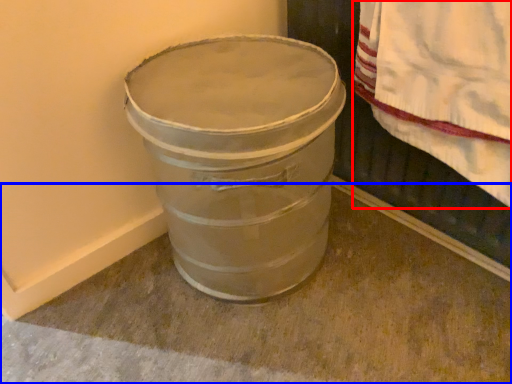
Question: Which of the following is the closest to the observer, blanket (highlighted by a red box) or concrete (highlighted by a blue box)?

Choices:
 (A) blanket
 (B) concrete

Answer: (B)